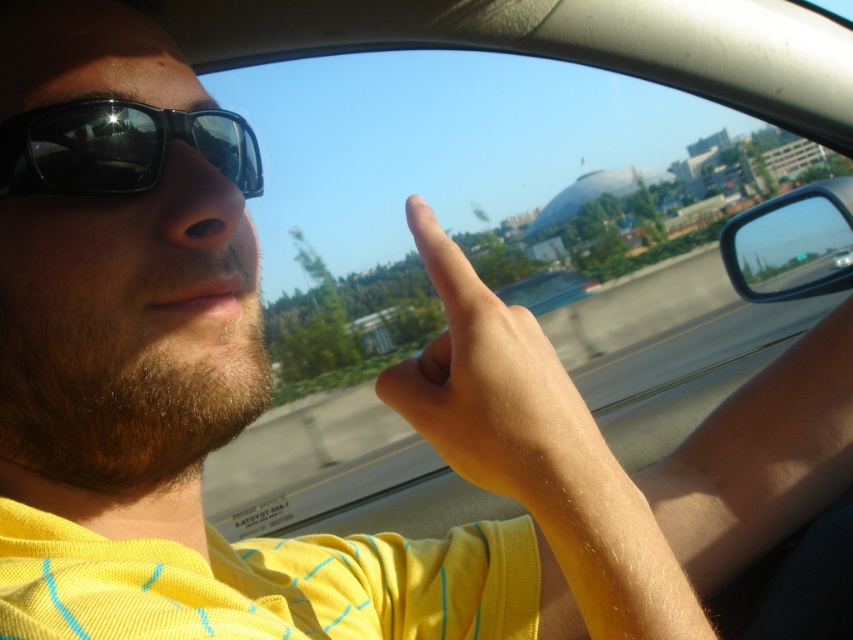
Question: Is transparent glass window at center below matte black sunglasses at upper left?

Choices:
 (A) no
 (B) yes

Answer: (A)

Question: Does transparent glass window at center lie behind matte black sunglasses at upper left?

Choices:
 (A) no
 (B) yes

Answer: (B)

Question: Which point is closer to the camera?

Choices:
 (A) skinny yellow finger at upper center
 (B) matte black sunglasses at upper left
 (C) transparent glass window at center

Answer: (A)

Question: Among these points, which one is nearest to the camera?

Choices:
 (A) (541, 444)
 (B) (218, 129)
 (C) (418, 477)

Answer: (A)

Question: Which point appears closest to the camera in this image?

Choices:
 (A) (79, 131)
 (B) (751, 342)

Answer: (A)

Question: Is skinny yellow finger at upper center positioned before matte black sunglasses at upper left?

Choices:
 (A) yes
 (B) no

Answer: (A)